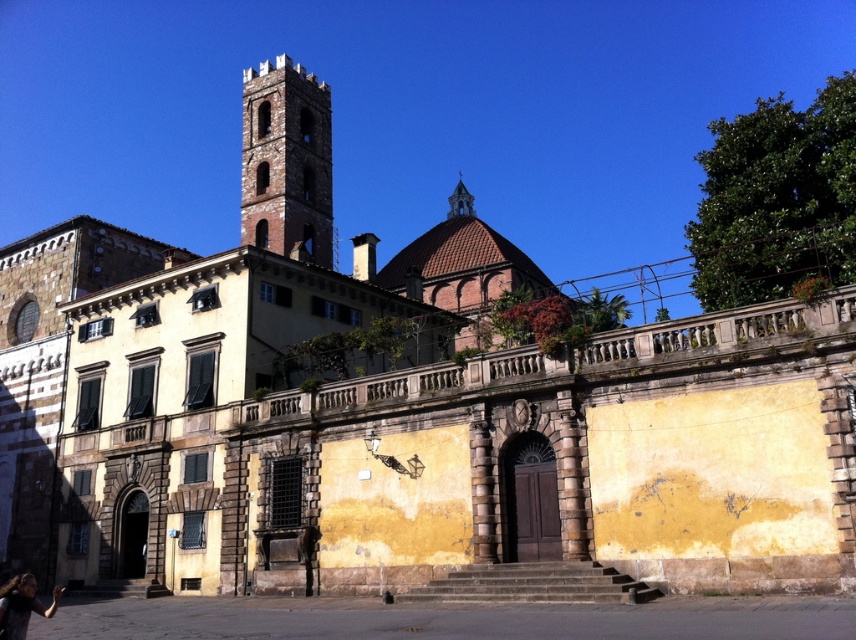
You are an architect examining this historic building complex. You notice the brown brick bell tower at upper left and the dark hair at lower left. Based on their sizes, which one do you think is more prominent in the image?

The brown brick bell tower at upper left is larger in size compared to the dark hair at lower left, so it is more prominent in the image.

You are a tourist standing in front of the historic building complex. You notice the brown brick bell tower at upper left and the dark hair at lower left. Which object is positioned higher in the image?

The brown brick bell tower at upper left is located above the dark hair at lower left, so it is positioned higher in the image.